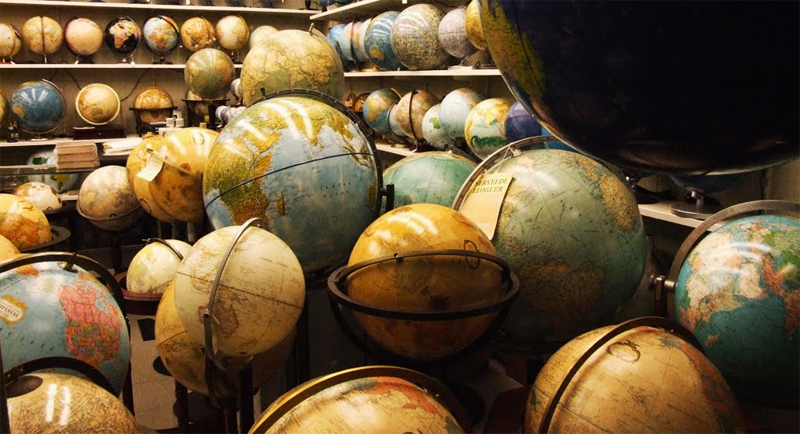
Identify the location of floor. The image size is (800, 434). (156, 397).